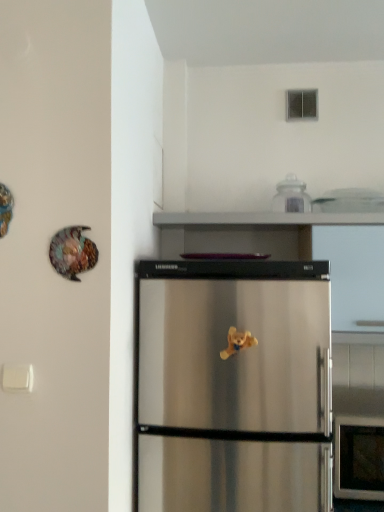
What is the approximate height of yellow plush bear at center?

10.83 centimeters.

Locate an element on the screen. The width and height of the screenshot is (384, 512). clear glass jar at upper center is located at coordinates (291, 196).

In order to face shiny metallic plate at upper left, should I rotate leftwards or rightwards?

Turn left by 16.049 degrees to look at shiny metallic plate at upper left.

Locate an element on the screen. yellow plush bear at center is located at coordinates (237, 342).

Is yellow plush bear at center touching shiny metallic plate at upper left?

No.

From a real-world perspective, does yellow plush bear at center sit lower than shiny metallic plate at upper left?

Yes, from a real-world perspective, yellow plush bear at center is under shiny metallic plate at upper left.

Can you confirm if yellow plush bear at center is bigger than shiny metallic plate at upper left?

Incorrect, yellow plush bear at center is not larger than shiny metallic plate at upper left.

In the image, is yellow plush bear at center positioned in front of or behind shiny metallic plate at upper left?

yellow plush bear at center is positioned farther from the viewer than shiny metallic plate at upper left.

Which of these two, clear glass jar at upper center or yellow plush bear at center, is smaller?

yellow plush bear at center is smaller.

In terms of width, does clear glass jar at upper center look wider or thinner when compared to yellow plush bear at center?

Considering their sizes, clear glass jar at upper center looks broader than yellow plush bear at center.

Between clear glass jar at upper center and yellow plush bear at center, which one is positioned in front?

Positioned in front is yellow plush bear at center.

Is clear glass jar at upper center at the right side of yellow plush bear at center?

Yes.

Looking at this image, from the image's perspective, is clear glass jar at upper center above shiny metallic plate at upper left?

Yes, from the image's perspective, clear glass jar at upper center is over shiny metallic plate at upper left.

Is clear glass jar at upper center not close to shiny metallic plate at upper left?

clear glass jar at upper center is actually quite close to shiny metallic plate at upper left.

There is a shiny metallic plate at upper left. Identify the location of appliance above it (from a real-world perspective). (291, 196).

Considering the relative sizes of clear glass jar at upper center and shiny metallic plate at upper left in the image provided, is clear glass jar at upper center smaller than shiny metallic plate at upper left?

No, clear glass jar at upper center is not smaller than shiny metallic plate at upper left.

Does point (65, 269) come in front of point (245, 347)?

That is True.

How different are the orientations of shiny metallic plate at upper left and yellow plush bear at center in degrees?

shiny metallic plate at upper left and yellow plush bear at center are facing 0.764 degrees away from each other.

Does shiny metallic plate at upper left have a smaller size compared to yellow plush bear at center?

No, shiny metallic plate at upper left is not smaller than yellow plush bear at center.

From the image's perspective, is shiny metallic plate at upper left positioned above or below yellow plush bear at center?

shiny metallic plate at upper left is situated higher than yellow plush bear at center in the image.

Would you say clear glass jar at upper center is part of shiny metallic plate at upper left's contents?

No, clear glass jar at upper center is not surrounded by shiny metallic plate at upper left.

From the picture: Can you tell me how much shiny metallic plate at upper left and clear glass jar at upper center differ in facing direction?

The angular difference between shiny metallic plate at upper left and clear glass jar at upper center is 0.531 degrees.

Can you confirm if shiny metallic plate at upper left is bigger than clear glass jar at upper center?

Actually, shiny metallic plate at upper left might be smaller than clear glass jar at upper center.

Consider the image. From a real-world perspective, is yellow plush bear at center on clear glass jar at upper center?

No.

Considering the positions of point (242, 346) and point (298, 207), is point (242, 346) closer or farther from the camera than point (298, 207)?

Point (242, 346) is closer to the camera than point (298, 207).

From the image's perspective, who appears lower, yellow plush bear at center or clear glass jar at upper center?

yellow plush bear at center is shown below in the image.

Does yellow plush bear at center have a smaller size compared to clear glass jar at upper center?

Indeed, yellow plush bear at center has a smaller size compared to clear glass jar at upper center.

You are a GUI agent. You are given a task and a screenshot of the screen. Output one action in this format:
    pyautogui.click(x=<x>, y=<y>)
    Task: Click on the toy that is under the shiny metallic plate at upper left (from a real-world perspective)
    
    Given the screenshot: What is the action you would take?
    pyautogui.click(x=237, y=342)

You are a GUI agent. You are given a task and a screenshot of the screen. Output one action in this format:
    pyautogui.click(x=<x>, y=<y>)
    Task: Click on the appliance above the yellow plush bear at center (from a real-world perspective)
    The width and height of the screenshot is (384, 512).
    Given the screenshot: What is the action you would take?
    pyautogui.click(x=291, y=196)

Looking at the image, which one is located further to clear glass jar at upper center, yellow plush bear at center or shiny metallic plate at upper left?

shiny metallic plate at upper left.

Which object lies nearer to the anchor point shiny metallic plate at upper left, clear glass jar at upper center or yellow plush bear at center?

Based on the image, yellow plush bear at center appears to be nearer to shiny metallic plate at upper left.

Looking at the image, which one is located closer to shiny metallic plate at upper left, yellow plush bear at center or clear glass jar at upper center?

yellow plush bear at center is positioned closer to the anchor shiny metallic plate at upper left.

Which object lies further to the anchor point yellow plush bear at center, shiny metallic plate at upper left or clear glass jar at upper center?

clear glass jar at upper center is positioned further to the anchor yellow plush bear at center.

Based on their spatial positions, is shiny metallic plate at upper left or yellow plush bear at center further from clear glass jar at upper center?

shiny metallic plate at upper left.

Looking at the image, which one is located further to yellow plush bear at center, clear glass jar at upper center or shiny metallic plate at upper left?

clear glass jar at upper center.

Where is `toy between shiny metallic plate at upper left and clear glass jar at upper center from left to right`? toy between shiny metallic plate at upper left and clear glass jar at upper center from left to right is located at coordinates (237, 342).